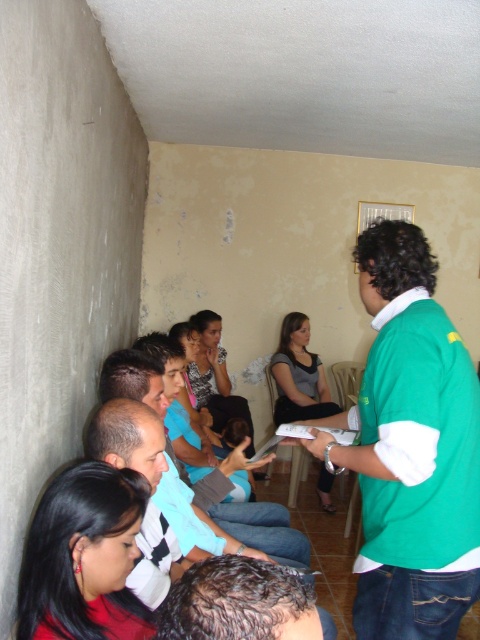
Question: Which object is farther from the camera taking this photo?

Choices:
 (A) dark brown hair at center
 (B) black hair at lower left

Answer: (B)

Question: Considering the relative positions of black hair at lower left and light blue shirt at center in the image provided, where is black hair at lower left located with respect to light blue shirt at center?

Choices:
 (A) left
 (B) right

Answer: (A)

Question: Is green fabric shirt at center wider than light blue shirt at center?

Choices:
 (A) no
 (B) yes

Answer: (A)

Question: Which point is closer to the camera?

Choices:
 (A) (108, 500)
 (B) (169, 499)

Answer: (A)

Question: Where is green fabric shirt at center located in relation to gray fabric shirt at center in the image?

Choices:
 (A) left
 (B) right

Answer: (A)

Question: Which of the following is the closest to the observer?

Choices:
 (A) (355, 616)
 (B) (183, 605)
 (C) (316, 484)
 (D) (129, 596)

Answer: (B)